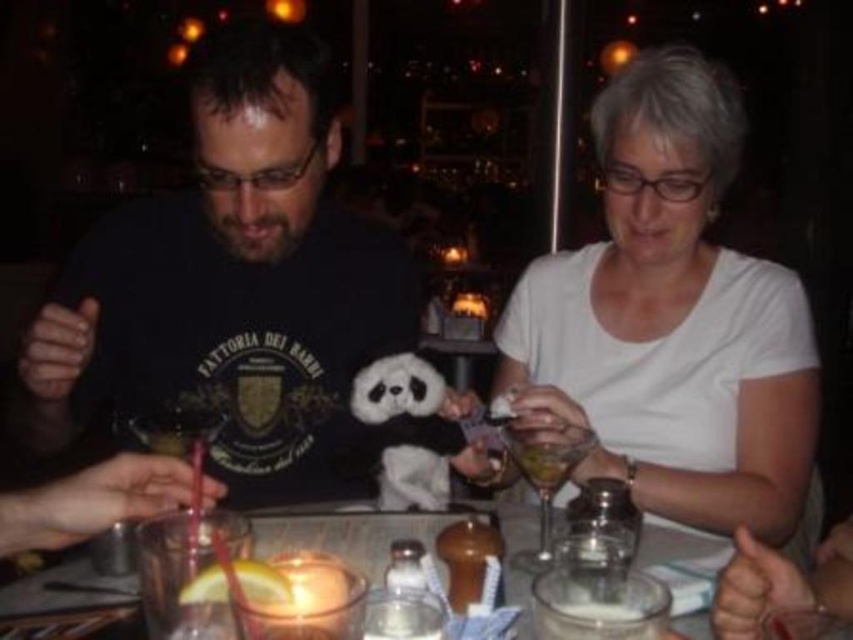
Question: Estimate the real-world distances between objects in this image. Which object is closer to the white plush toy at center?

Choices:
 (A) white frothy milk at center
 (B) translucent glass at center

Answer: (B)

Question: Is translucent glass at center behind white plush toy at center?

Choices:
 (A) yes
 (B) no

Answer: (B)

Question: Which object is the closest to the white frothy milk at center?

Choices:
 (A) white plush toy at center
 (B) black matte t-shirt at center

Answer: (A)

Question: Is black matte t-shirt at center thinner than white frothy milk at center?

Choices:
 (A) yes
 (B) no

Answer: (B)

Question: Is translucent glass at center thinner than translucent glass at lower center?

Choices:
 (A) yes
 (B) no

Answer: (B)

Question: Which point is closer to the camera taking this photo?

Choices:
 (A) (213, 579)
 (B) (740, 144)

Answer: (A)